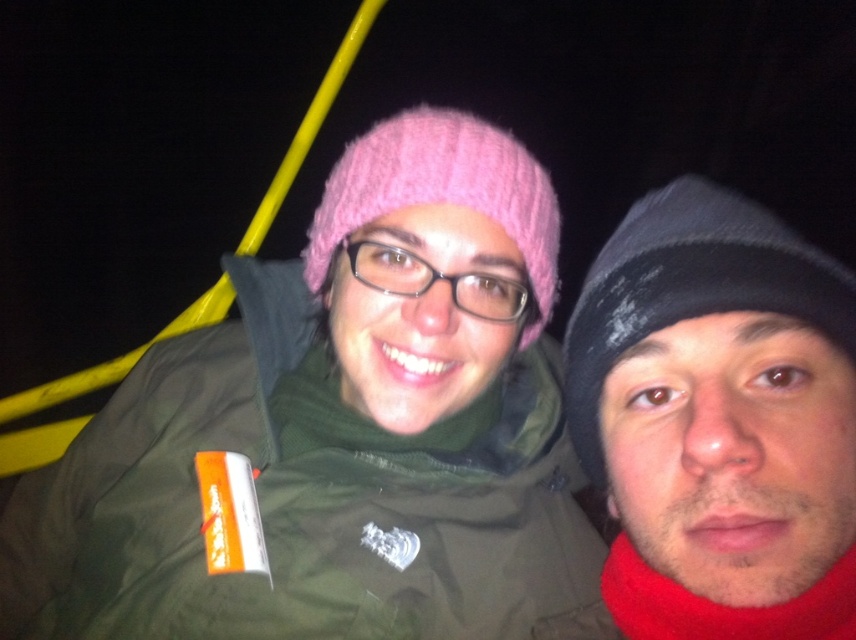
Can you confirm if black knit beanie at right is bigger than pink knitted hat at center?

No.

Does black knit beanie at right appear on the right side of pink knitted hat at center?

Indeed, black knit beanie at right is positioned on the right side of pink knitted hat at center.

Between point (768, 224) and point (504, 198), which one is positioned behind?

Positioned behind is point (504, 198).

Find the location of a particular element. black knit beanie at right is located at coordinates (690, 288).